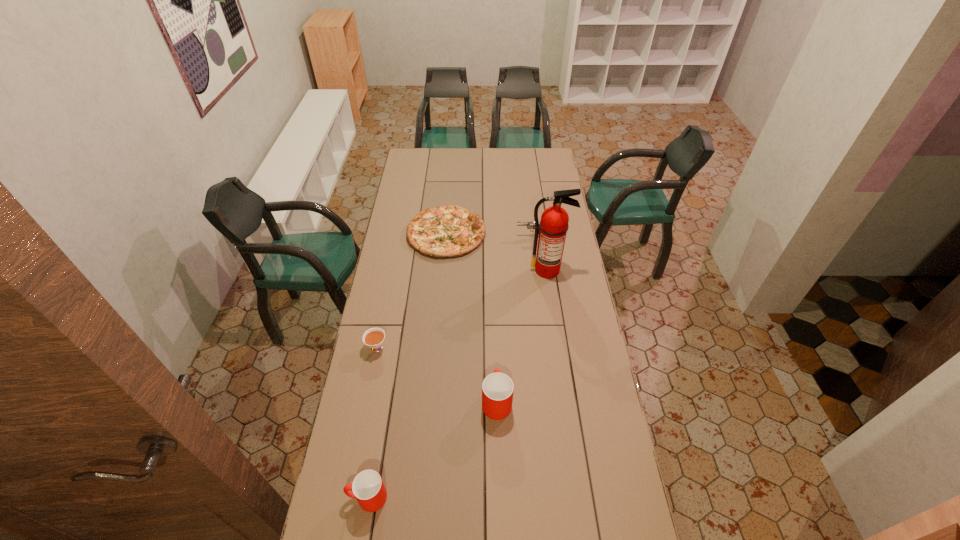
In the current image, all cups are evenly spaced. To maintain this equal spacing, where should an additional cup be placed on the right? Please point out a free spot. Please provide its 2D coordinates. Your answer should be formatted as a tuple, i.e. [(x, y)], where the tuple contains the x and y coordinates of a point satisfying the conditions above.

[(593, 328)]